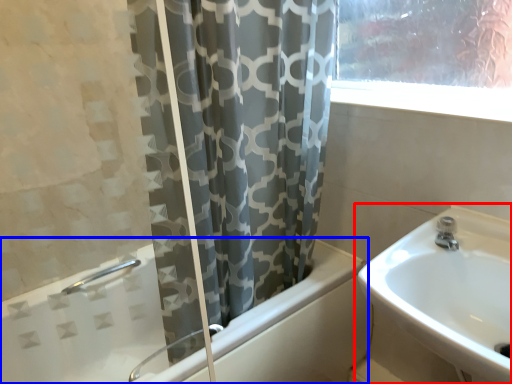
Question: Which object is closer to the camera taking this photo, sink (highlighted by a red box) or bathtub (highlighted by a blue box)?

Choices:
 (A) sink
 (B) bathtub

Answer: (A)